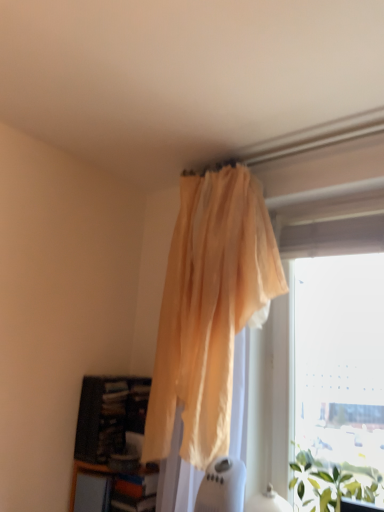
Question: From the image's perspective, does transparent plastic window at upper right appear lower than dark wood bookcase at lower left?

Choices:
 (A) yes
 (B) no

Answer: (B)

Question: Considering the relative sizes of transparent plastic window at upper right and dark wood bookcase at lower left in the image provided, is transparent plastic window at upper right thinner than dark wood bookcase at lower left?

Choices:
 (A) no
 (B) yes

Answer: (B)

Question: Is the position of transparent plastic window at upper right less distant than that of dark wood bookcase at lower left?

Choices:
 (A) no
 (B) yes

Answer: (B)

Question: Considering the relative sizes of transparent plastic window at upper right and dark wood bookcase at lower left in the image provided, is transparent plastic window at upper right bigger than dark wood bookcase at lower left?

Choices:
 (A) no
 (B) yes

Answer: (B)

Question: From the image's perspective, does transparent plastic window at upper right appear higher than dark wood bookcase at lower left?

Choices:
 (A) no
 (B) yes

Answer: (B)

Question: Is the depth of transparent plastic window at upper right greater than that of dark wood bookcase at lower left?

Choices:
 (A) yes
 (B) no

Answer: (B)

Question: Is transparent plastic window at upper right facing away from green leafy plant at lower right?

Choices:
 (A) no
 (B) yes

Answer: (A)

Question: Could green leafy plant at lower right be considered to be inside transparent plastic window at upper right?

Choices:
 (A) yes
 (B) no

Answer: (B)

Question: From the image's perspective, is transparent plastic window at upper right over green leafy plant at lower right?

Choices:
 (A) yes
 (B) no

Answer: (A)

Question: From a real-world perspective, is transparent plastic window at upper right physically above green leafy plant at lower right?

Choices:
 (A) no
 (B) yes

Answer: (B)

Question: Is transparent plastic window at upper right at the right side of green leafy plant at lower right?

Choices:
 (A) no
 (B) yes

Answer: (B)

Question: Does transparent plastic window at upper right have a smaller size compared to green leafy plant at lower right?

Choices:
 (A) yes
 (B) no

Answer: (B)

Question: Is green leafy plant at lower right a part of translucent yellow curtain at upper center?

Choices:
 (A) no
 (B) yes

Answer: (A)